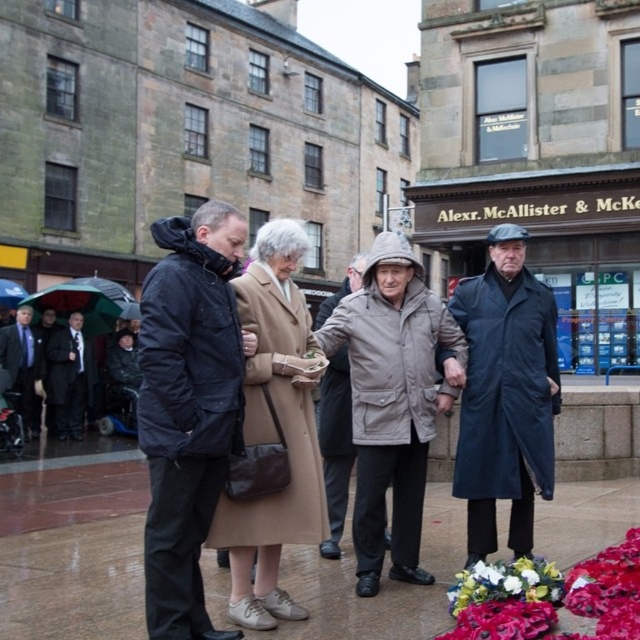
You are standing in the public square in front of Alexr. McAllister and McKee. You need to walk to a specific location marked by two points on the pavement. The first point is at coordinates point [61,387] and the second point is at point [13,288]. Which point should you approach first if you want to reach the one closer to you?

Point [61,387] is closer to the viewer than point [13,288], so you should approach point [61,387] first.

You are a pedestrian trying to cross the street in the rain. You see a beige fabric coat at center and a green fabric umbrella at left. Which object is closer to the left side of the image?

The green fabric umbrella at left is closer to the left side of the image because it is positioned to the left of the beige fabric coat at center.

You are standing at the center of the image. Which direction should you look to see the matte black suit at left?

You should look to the left because the matte black suit at left is located at point (67, 380), which is on the left side of the image.